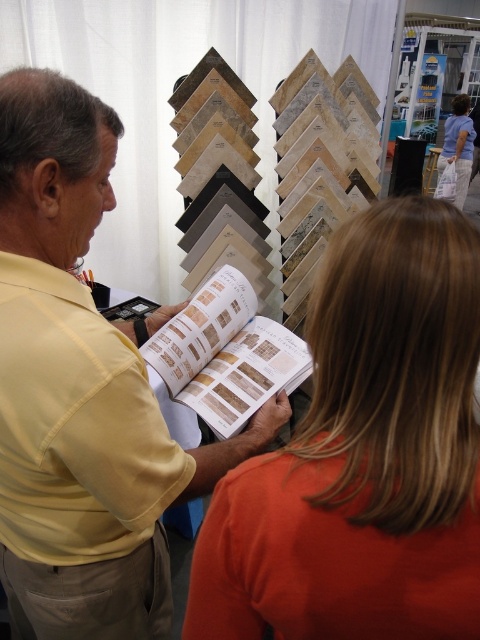
You are a photographer positioned at the back of the exhibition hall. You want to take a photo of the wooden book at center without the orange matte shirt at center blocking it. Is this possible given their positions?

The orange matte shirt at center is closer to the viewer than wooden book at center, so it will block the view of the wooden book at center. Therefore, it is not possible to take a photo of the wooden book at center without the orange matte shirt at center blocking it.

You are a salesperson at the exhibition and need to hand a catalog to a customer. The wooden book at center is your catalog. The orange matte shirt at center is the customer. Can you reach the customer with the catalog without moving your position?

The orange matte shirt at center and wooden book at center are 19.99 inches apart, so yes, you can reach the customer with the catalog without moving your position since the distance is within a comfortable arm reach.

Based on the photo, you are a photographer at the event and need to position a light so that it can illuminate both the yellow matte shirt at center and the orange fabric shirt at upper right equally. Considering their heights, where should you place the light?

The yellow matte shirt at center is shorter than the orange fabric shirt at upper right. To ensure equal illumination, position the light above and slightly closer to the yellow matte shirt at center so that the light reaches both shirts effectively, compensating for the height difference.